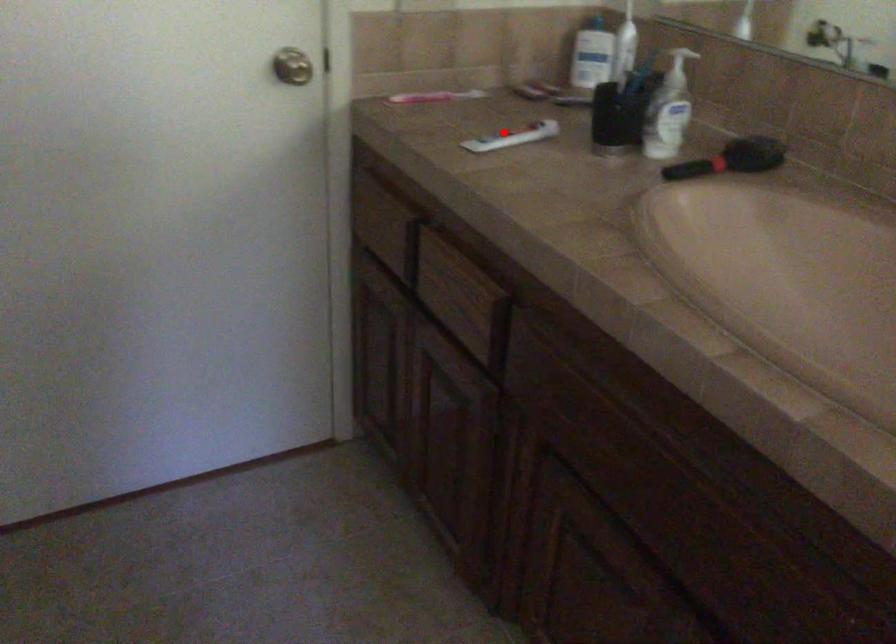
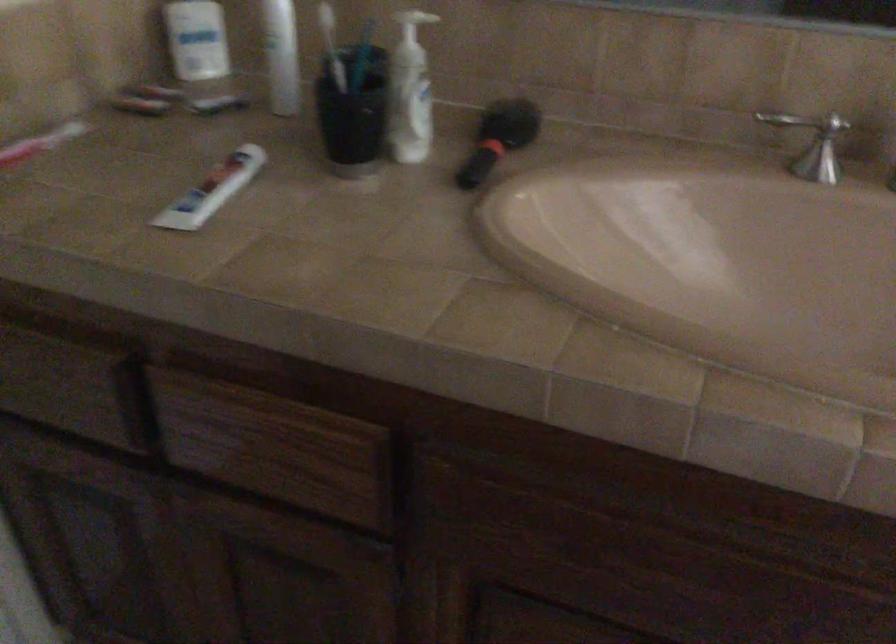
In the second image, find the point that corresponds to the highlighted location in the first image.

(211, 190)